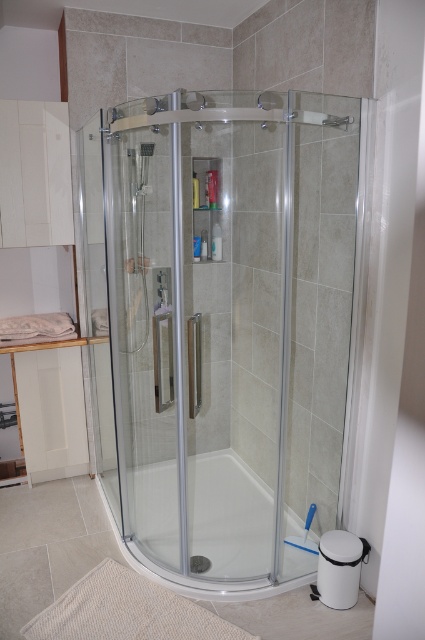
Question: Is transparent glass shower door at center further to camera compared to transparent glass bathtub at center?

Choices:
 (A) yes
 (B) no

Answer: (B)

Question: Which point is closer to the camera?

Choices:
 (A) transparent glass bathtub at center
 (B) transparent glass shower door at center

Answer: (B)

Question: Does transparent glass shower door at center come behind transparent glass bathtub at center?

Choices:
 (A) yes
 (B) no

Answer: (B)

Question: Is transparent glass shower door at center above transparent glass bathtub at center?

Choices:
 (A) no
 (B) yes

Answer: (B)